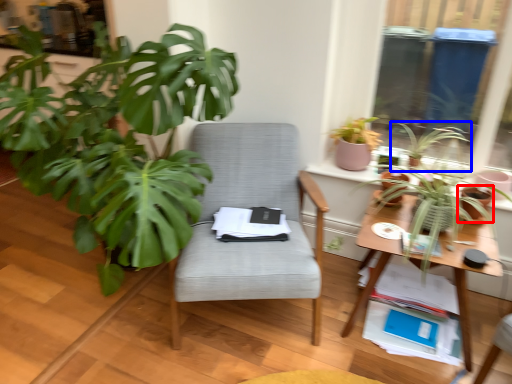
Question: Which object appears farthest to the camera in this image, flowerpot (highlighted by a red box) or houseplant (highlighted by a blue box)?

Choices:
 (A) flowerpot
 (B) houseplant

Answer: (B)